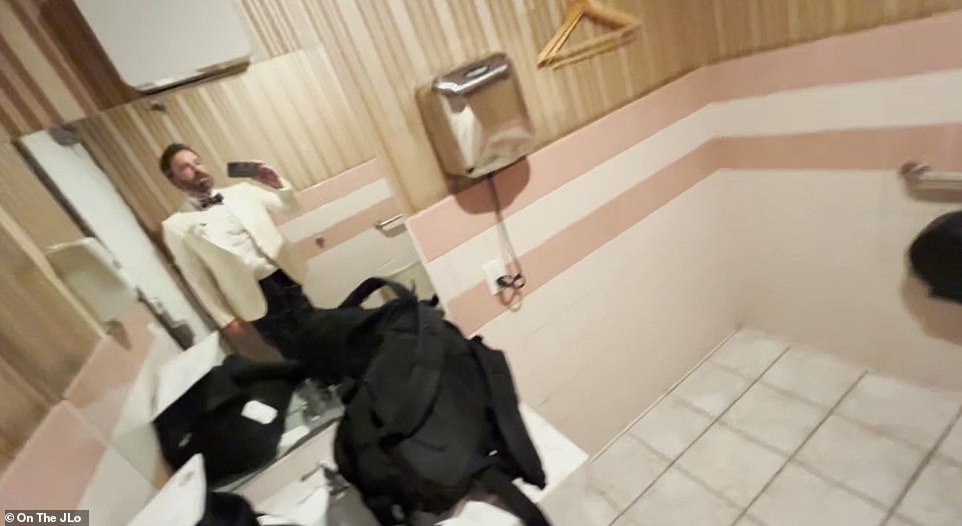
Find the location of a particular element. The image size is (962, 526). floor is located at coordinates (776, 432).